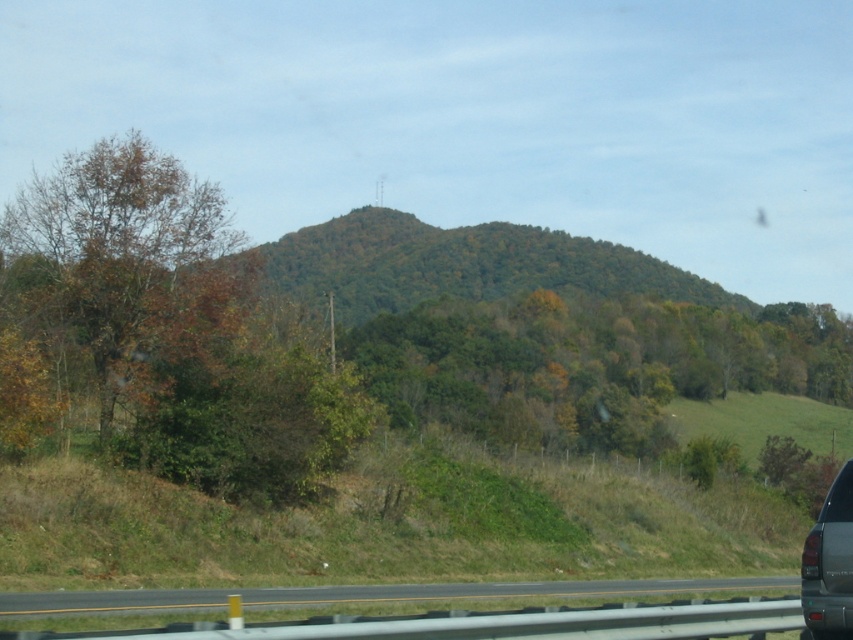
Question: Can you confirm if black asphalt road at lower center is positioned to the left of metallic gray suv at lower right?

Choices:
 (A) yes
 (B) no

Answer: (A)

Question: Is black asphalt road at lower center to the left of metallic gray suv at lower right from the viewer's perspective?

Choices:
 (A) yes
 (B) no

Answer: (A)

Question: Which point is closer to the camera?

Choices:
 (A) metallic gray suv at lower right
 (B) black asphalt road at lower center

Answer: (A)

Question: Among these points, which one is nearest to the camera?

Choices:
 (A) (634, 586)
 (B) (170, 188)
 (C) (838, 620)

Answer: (C)

Question: Can you confirm if brown leafy tree at left is positioned to the left of metallic gray suv at lower right?

Choices:
 (A) yes
 (B) no

Answer: (A)

Question: Which object is farther from the camera taking this photo?

Choices:
 (A) metallic gray suv at lower right
 (B) black asphalt road at lower center

Answer: (B)